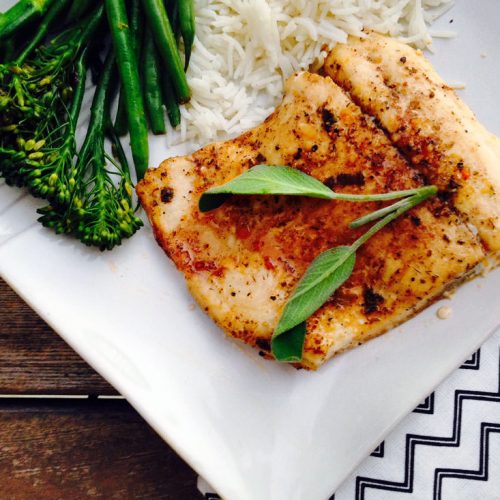
Image resolution: width=500 pixels, height=500 pixels. I want to click on meal on a white plate, so click(x=403, y=10), click(x=200, y=84), click(x=147, y=86), click(x=81, y=130), click(x=223, y=283).